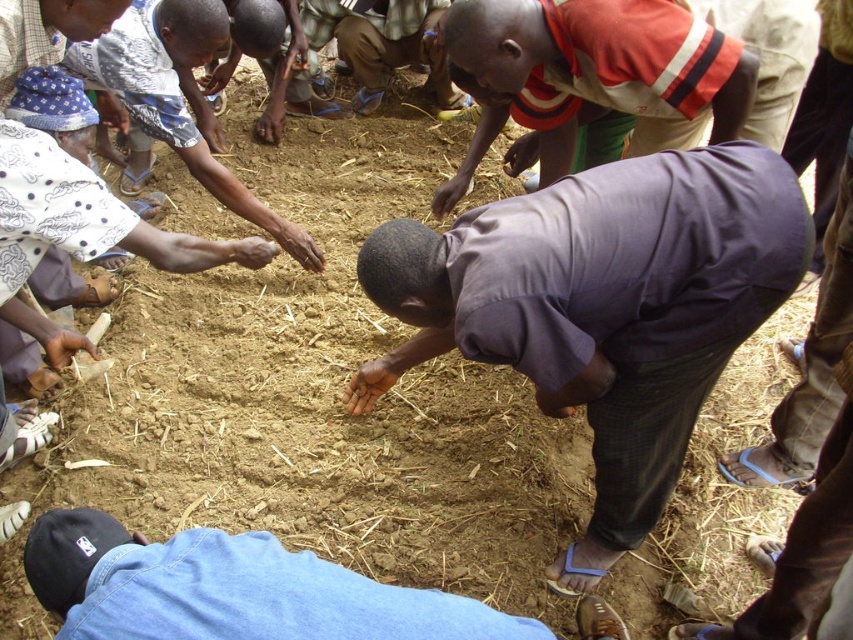
Question: Among these objects, which one is farthest from the camera?

Choices:
 (A) purple cotton shirt at center
 (B) blue denim jeans at lower center
 (C) light blue fabric at upper left

Answer: (C)

Question: Among these points, which one is nearest to the camera?

Choices:
 (A) (666, 12)
 (B) (44, 588)
 (C) (590, 220)

Answer: (B)

Question: Is purple cotton shirt at center above blue denim jeans at lower center?

Choices:
 (A) yes
 (B) no

Answer: (A)

Question: Can you confirm if purple cotton shirt at center is bigger than light blue fabric at upper left?

Choices:
 (A) yes
 (B) no

Answer: (A)

Question: Is purple cotton shirt at center thinner than red and white striped shirt at center?

Choices:
 (A) no
 (B) yes

Answer: (A)

Question: Among these objects, which one is farthest from the camera?

Choices:
 (A) red and white striped shirt at center
 (B) light blue fabric at upper left
 (C) purple cotton shirt at center
 (D) blue denim jeans at lower center

Answer: (B)